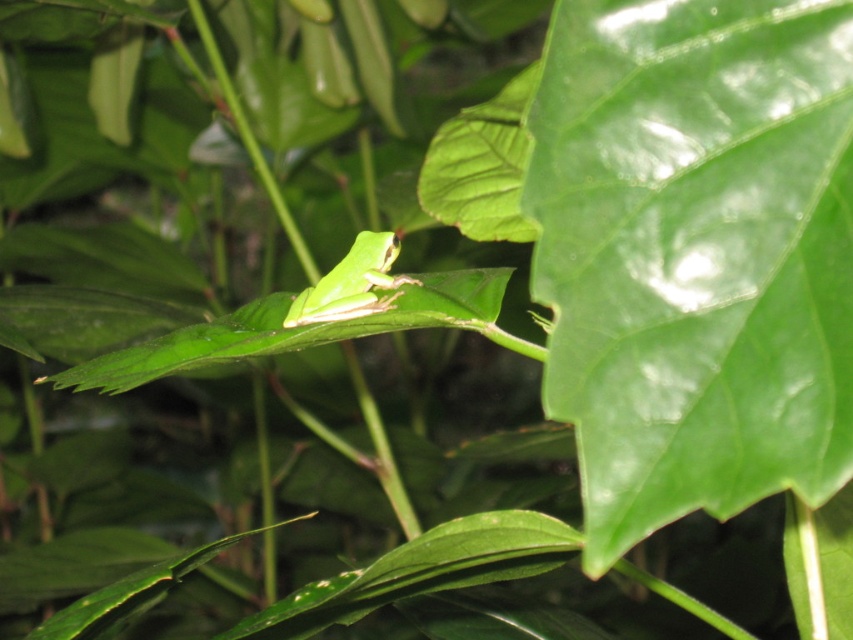
You are a gardener trying to identify the larger object between the green matte leaf at center and the green matte frog at center in the image. Which one is bigger?

The green matte frog at center is larger than the green matte leaf at center.

You are a photographer trying to capture a clear image of both the green matte leaf at center and the green matte frog at center. Since you want to focus on the frog, which object should you adjust your camera focus to prioritize?

You should prioritize focusing on the green matte frog at center because it is farther from the viewer than the green matte leaf at center, ensuring it is in sharp focus while the leaf may naturally be in focus due to its proximity.

You are a frog observer trying to track the frog in the image. You see two points marked in the image. The first point is at coordinate point (816, 356) and the second point is at coordinate point (368, 243). Which point is closer to you?

Point (816, 356) is in front of point (368, 243), so the first point is closer to you.